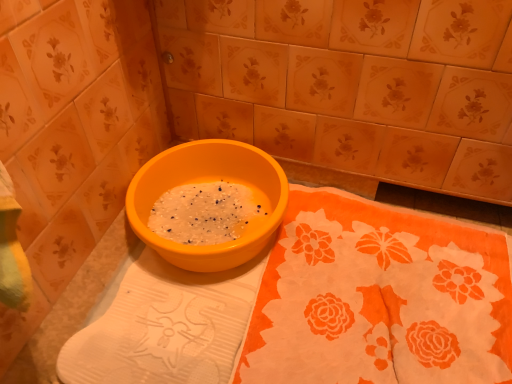
Question: From a real-world perspective, is orange fabric at center under matte plastic basin at center?

Choices:
 (A) no
 (B) yes

Answer: (B)

Question: Is orange fabric at center bigger than matte plastic basin at center?

Choices:
 (A) yes
 (B) no

Answer: (B)

Question: Is orange fabric at center further to camera compared to matte plastic basin at center?

Choices:
 (A) no
 (B) yes

Answer: (A)

Question: Can you confirm if orange fabric at center is taller than matte plastic basin at center?

Choices:
 (A) no
 (B) yes

Answer: (A)

Question: Can you confirm if orange fabric at center is shorter than matte plastic basin at center?

Choices:
 (A) yes
 (B) no

Answer: (A)

Question: Based on their positions, is matte plastic basin at center located to the left or right of matte ceramic tile at center?

Choices:
 (A) left
 (B) right

Answer: (A)

Question: In terms of width, does matte plastic basin at center look wider or thinner when compared to matte ceramic tile at center?

Choices:
 (A) thin
 (B) wide

Answer: (A)

Question: Which is correct: matte plastic basin at center is inside matte ceramic tile at center, or outside of it?

Choices:
 (A) inside
 (B) outside

Answer: (B)

Question: Relative to matte ceramic tile at center, is matte plastic basin at center in front or behind?

Choices:
 (A) front
 (B) behind

Answer: (B)

Question: Is matte ceramic tile at center in front of or behind matte plastic basin at center in the image?

Choices:
 (A) front
 (B) behind

Answer: (A)

Question: From the image's perspective, is matte ceramic tile at center positioned above or below matte plastic basin at center?

Choices:
 (A) below
 (B) above

Answer: (B)

Question: Do you think matte ceramic tile at center is within matte plastic basin at center, or outside of it?

Choices:
 (A) inside
 (B) outside

Answer: (B)

Question: From a real-world perspective, is matte ceramic tile at center physically located above or below matte plastic basin at center?

Choices:
 (A) above
 (B) below

Answer: (A)

Question: In terms of width, does orange fabric at center look wider or thinner when compared to matte ceramic tile at center?

Choices:
 (A) wide
 (B) thin

Answer: (B)

Question: Considering the positions of orange fabric at center and matte ceramic tile at center in the image, is orange fabric at center taller or shorter than matte ceramic tile at center?

Choices:
 (A) tall
 (B) short

Answer: (B)